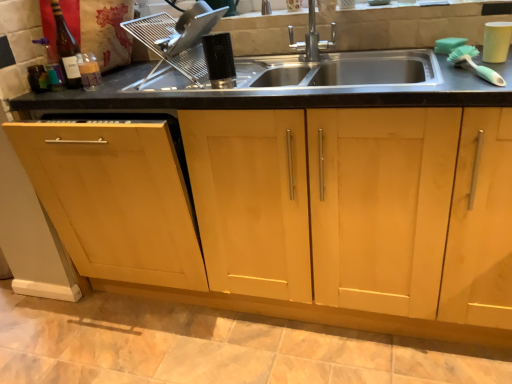
Question: Is satin silver dish rack at upper center, which is the 3th appliance from right to left, inside or outside of light wood cabinet at center?

Choices:
 (A) inside
 (B) outside

Answer: (B)

Question: From a real-world perspective, relative to light wood cabinet at center, is satin silver dish rack at upper center, acting as the first appliance starting from the left, vertically above or below?

Choices:
 (A) below
 (B) above

Answer: (B)

Question: Which of these objects is positioned closest to the light wood cabinet at center?

Choices:
 (A) white matte cup at upper right, the 3th appliance positioned from the left
 (B) translucent glass bottle at upper left
 (C) black plastic comb at center, positioned as the 2th appliance in left-to-right order
 (D) satin silver dish rack at upper center, which is the 3th appliance from right to left

Answer: (C)

Question: Estimate the real-world distances between objects in this image. Which object is closer to the light wood cabinet at center?

Choices:
 (A) white matte cup at upper right, the 3th appliance positioned from the left
 (B) translucent glass bottle at upper left
 (C) black plastic comb at center, which is counted as the second appliance, starting from the right
 (D) satin silver dish rack at upper center, acting as the first appliance starting from the left

Answer: (C)